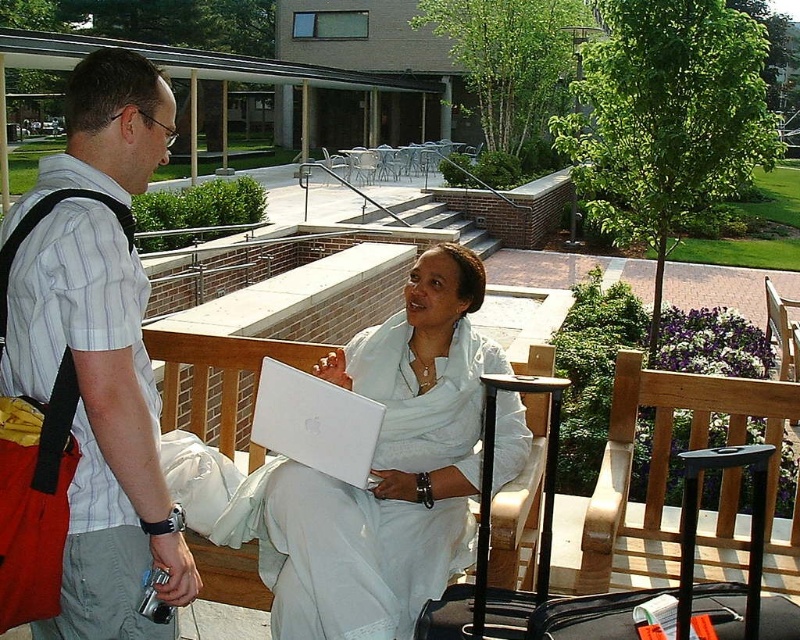
You are standing at the edge of the scene and want to pick up the black suitcase at lower right and the black hard suitcase at center. Which one can you reach without moving closer to the scene?

The black suitcase at lower right is closer to the viewer, so you can reach it without moving closer. The black hard suitcase at center is further away and would require moving closer to reach.

You are a delivery person who needs to place both the white matte laptop at center and the black hard suitcase at center into a storage container that can only accommodate items up to the width of the wider object. Which object determines the minimum required width of the container?

The white matte laptop at center determines the minimum required width of the container because its width surpasses that of the black hard suitcase at center.

You are standing at the back of the scene and want to take a photo of the matte black shirt at left and the black hard suitcase at center. Which object should you focus on first to ensure both are in frame?

The matte black shirt at left is located above the black hard suitcase at center, so you should focus on the black hard suitcase at center first to ensure both are in frame.